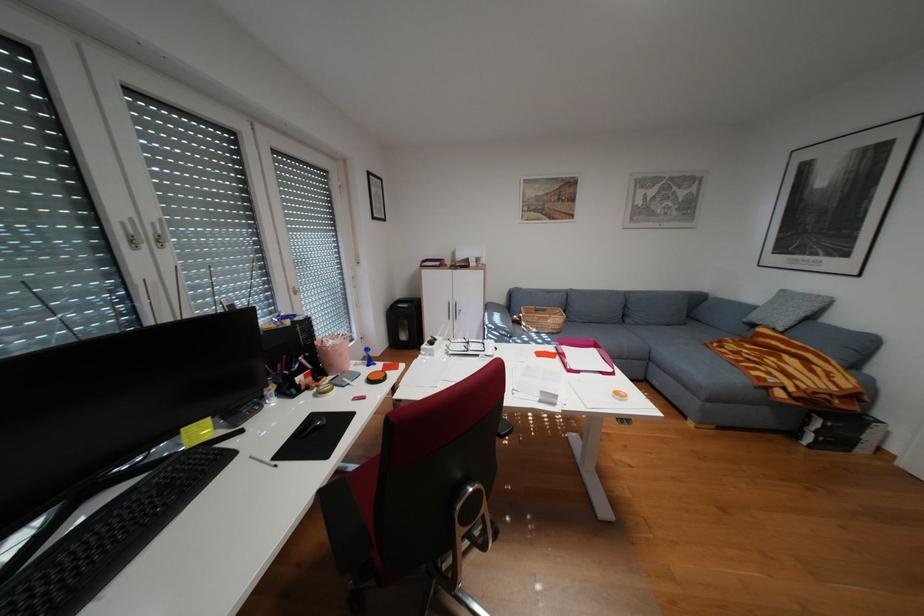
The location [584,355] corresponds to which object?

It refers to a pink paper tray.